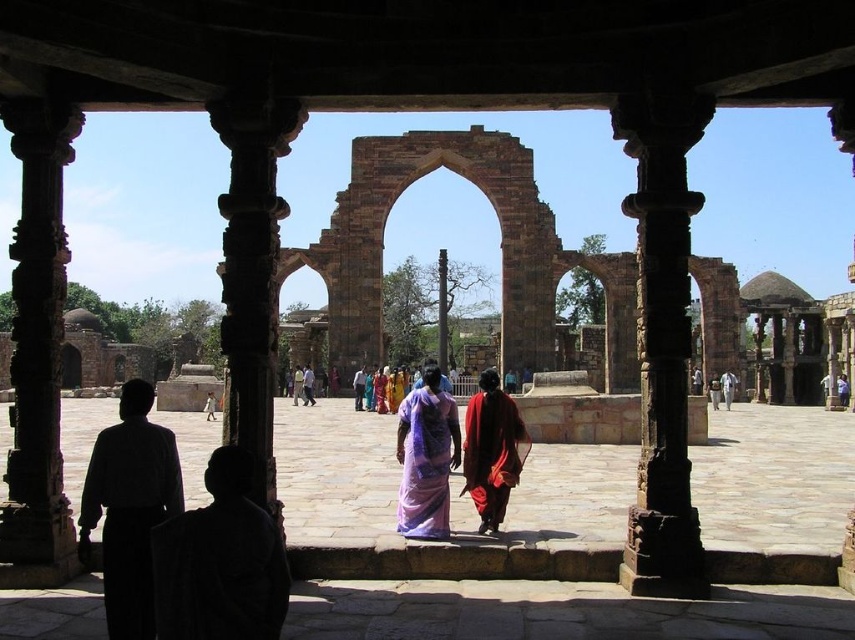
Based on the photo, you are a visitor at this historical site and notice two robes in the scene. The silhouette robe at left and the red silk robe at center. Which robe appears taller from your viewing position?

The silhouette robe at left appears taller than the red silk robe at center based on their positions in the image.